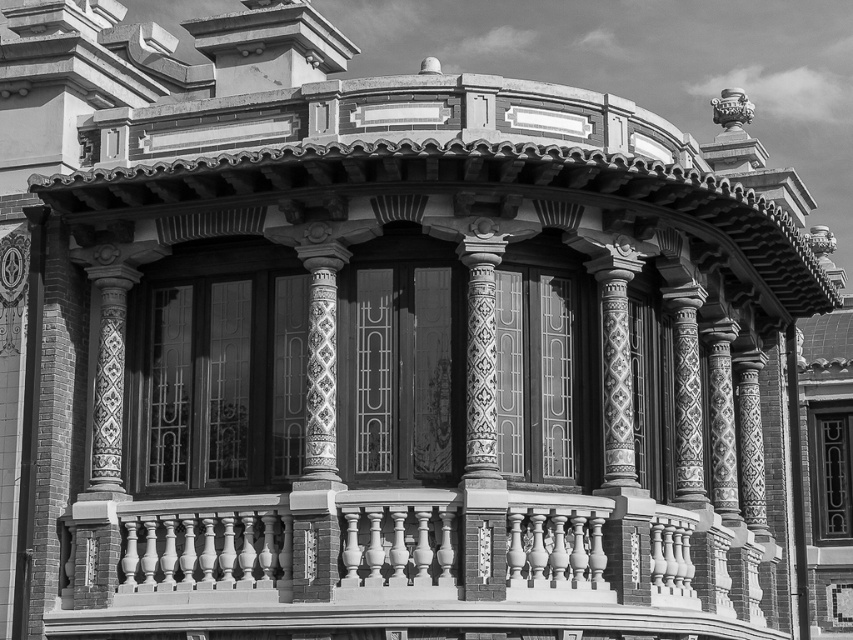
Question: Which point appears farthest from the camera in this image?

Choices:
 (A) (601, 548)
 (B) (303, 577)

Answer: (A)

Question: Does smooth white balustrade at lower center come in front of decorative tile column at center?

Choices:
 (A) yes
 (B) no

Answer: (A)

Question: Does smooth white balustrade at lower center have a lesser width compared to decorative tile column at center?

Choices:
 (A) yes
 (B) no

Answer: (B)

Question: Is smooth white balustrade at lower center bigger than decorative tile column at center?

Choices:
 (A) no
 (B) yes

Answer: (B)

Question: Which point is farther to the camera?

Choices:
 (A) (334, 470)
 (B) (86, 628)

Answer: (B)